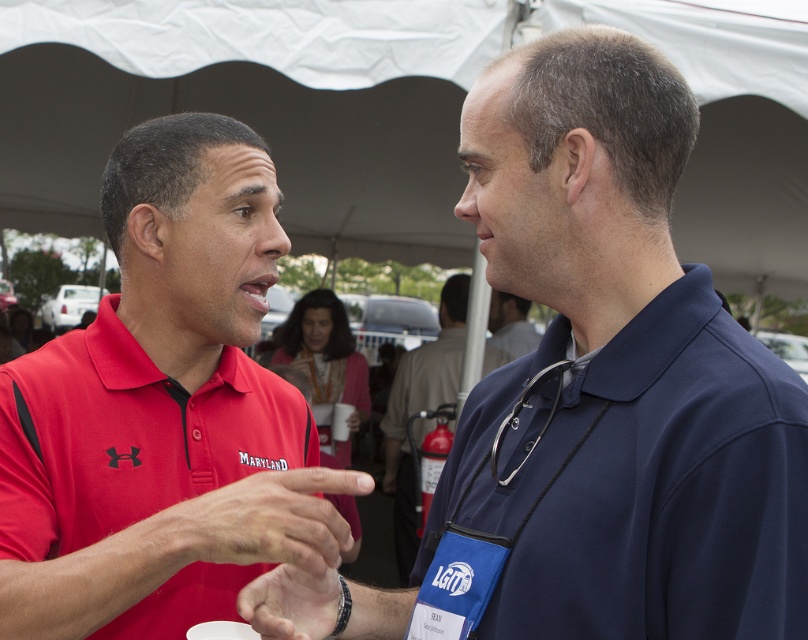
You are standing at the origin point in the image. Which object is located at the coordinates point (617, 371)?

The navy blue shirt at center is located at point (617, 371).

You are a photographer standing 2 meters away from the red matte polo shirt at center and smooth leather hand at center. You want to capture a closeup shot of both objects in the same frame without moving your position. Can you do it with a standard camera lens that has a maximum focal length of 50mm?

The distance between the red matte polo shirt at center and smooth leather hand at center is 30.89 centimeters. With a standard 50mm lens, you can adjust your zoom to capture both objects within the frame since the separation between them is relatively small and manageable at this focal length.

You are standing at the center of the image and want to locate the navy blue shirt at center. Which direction should you look to find it?

The navy blue shirt at center is located at point (617, 371), so you should look slightly to the right and down from the center to find it.